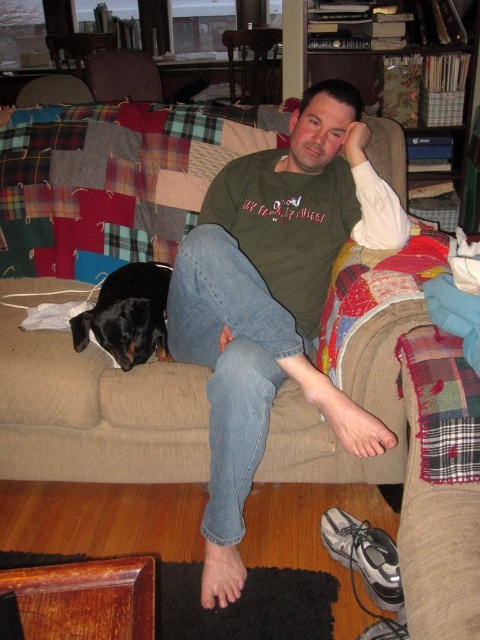
Question: Which point is farther from the camera taking this photo?

Choices:
 (A) (141, 266)
 (B) (373, 163)

Answer: (B)

Question: Which object is the farthest from the black smooth dog at lower left?

Choices:
 (A) green cotton shirt at center
 (B) beige fabric couch at center

Answer: (A)

Question: Which point appears closest to the camera in this image?

Choices:
 (A) (292, 444)
 (B) (324, 156)

Answer: (A)

Question: Can you confirm if green cotton shirt at center is bigger than black smooth dog at lower left?

Choices:
 (A) no
 (B) yes

Answer: (B)

Question: Does green cotton shirt at center appear over beige fabric couch at center?

Choices:
 (A) no
 (B) yes

Answer: (B)

Question: Can you confirm if green cotton shirt at center is smaller than black smooth dog at lower left?

Choices:
 (A) yes
 (B) no

Answer: (B)